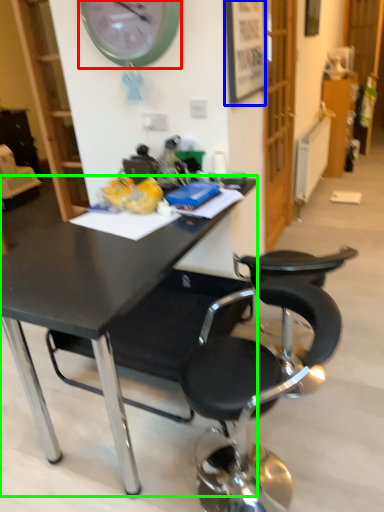
Question: Considering the real-world distances, which object is farthest from wall clock (highlighted by a red box)? picture frame (highlighted by a blue box) or desk (highlighted by a green box)?

Choices:
 (A) picture frame
 (B) desk

Answer: (B)